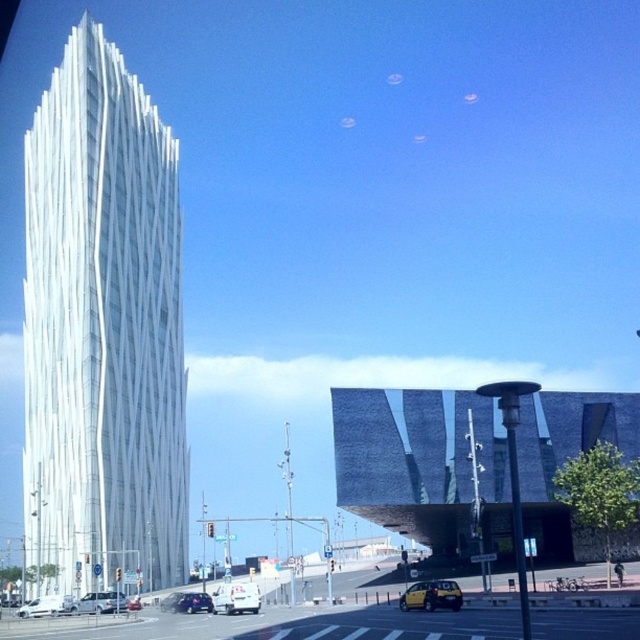
You are a pedestrian standing at the edge of the road in this urban scene. You see a yellow matte taxi at lower center and a metallic silver sedan at center. Which vehicle is positioned closer to the right side of the road?

The yellow matte taxi at lower center is positioned to the right of the metallic silver sedan at center, so it is closer to the right side of the road.

You are a pedestrian standing at the corner of the street looking towards the white glass skyscraper at left. You see the silver metallic van at lower left parked nearby. From your vantage point, which object is closer to you?

The white glass skyscraper at left is closer to you because the silver metallic van at lower left is behind it.